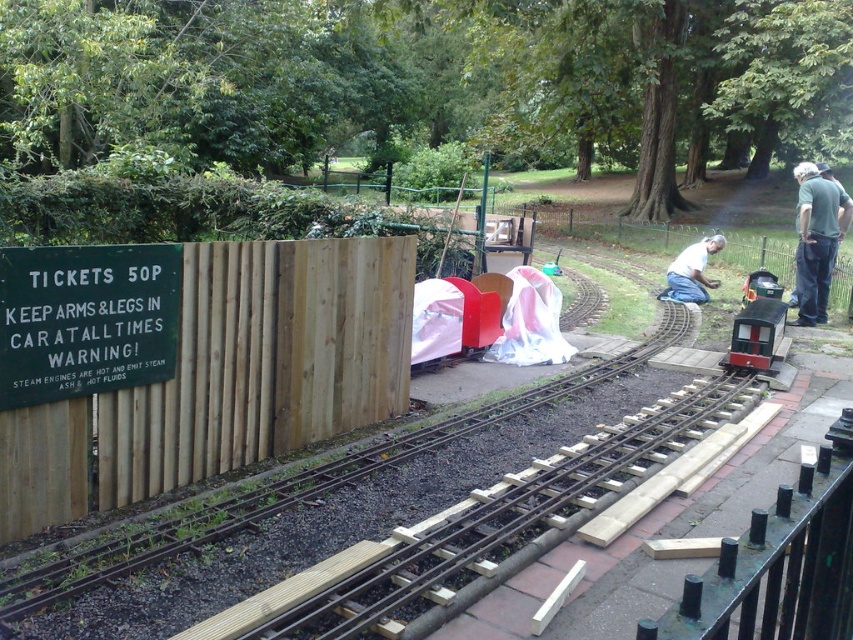
Find the location of a particular element. Image resolution: width=853 pixels, height=640 pixels. gray fabric at right is located at coordinates (817, 240).

Does point (802, 314) come closer to viewer compared to point (689, 289)?

Yes, it is.

Which is behind, point (819, 241) or point (677, 282)?

The point (677, 282) is more distant.

At what (x,y) coordinates should I click in order to perform the action: click on gray fabric at right. Please return your answer as a coordinate pair (x, y). Looking at the image, I should click on (817, 240).

How far apart are gray fabric at right and metallic green train at center?

The distance of gray fabric at right from metallic green train at center is 2.72 meters.

Which is more to the right, gray fabric at right or metallic green train at center?

gray fabric at right

Where is `gray fabric at right`? The image size is (853, 640). gray fabric at right is located at coordinates (817, 240).

This screenshot has width=853, height=640. Find the location of `gray fabric at right`. gray fabric at right is located at coordinates pos(817,240).

Does metallic green train at center appear on the left side of white shirt at center?

Correct, you'll find metallic green train at center to the left of white shirt at center.

Who is taller, metallic green train at center or white shirt at center?

Standing taller between the two is white shirt at center.

Describe the element at coordinates (757, 323) in the screenshot. The image size is (853, 640). I see `metallic green train at center` at that location.

Where is `metallic green train at center`? metallic green train at center is located at coordinates (757, 323).